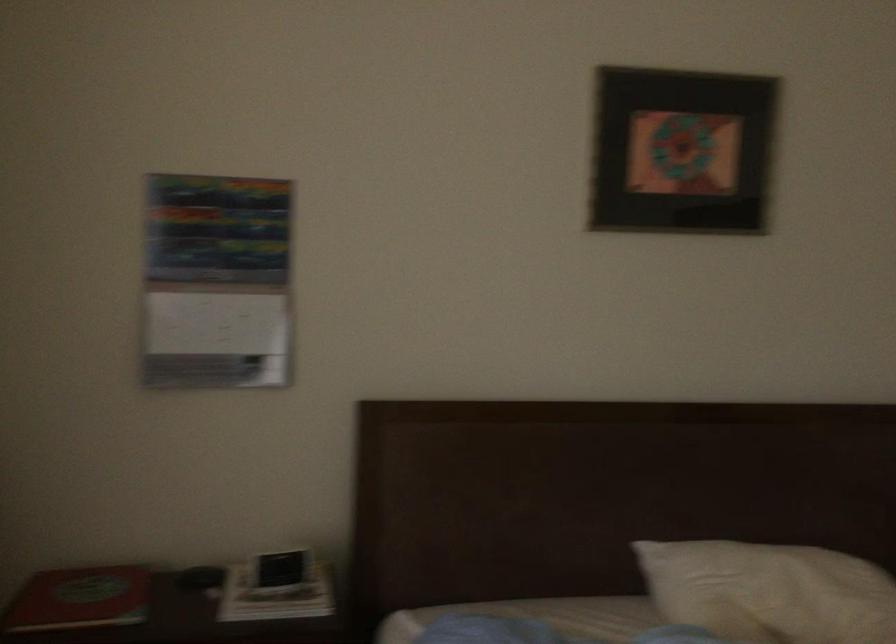
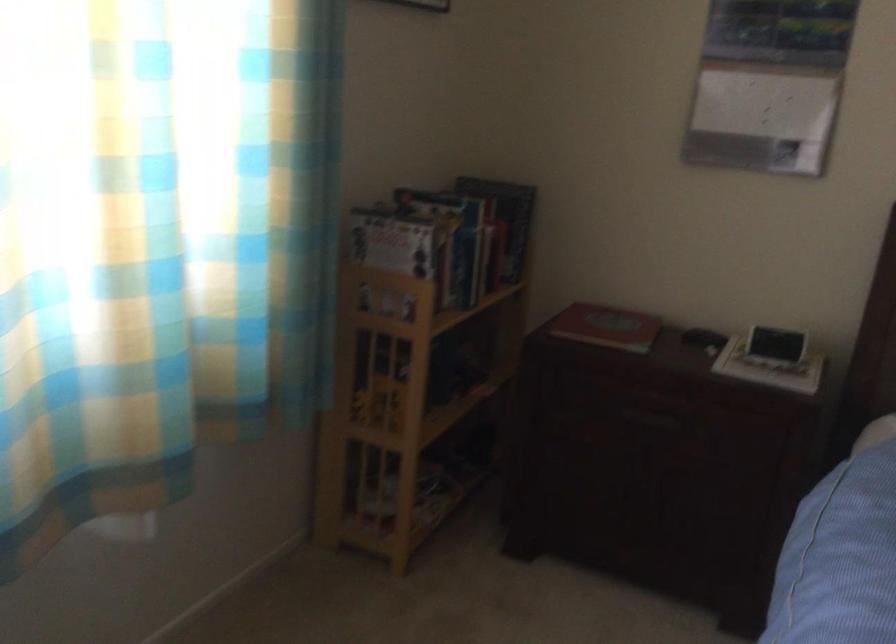
In the second image, find the point that corresponds to point 282,573 in the first image.

(776, 344)